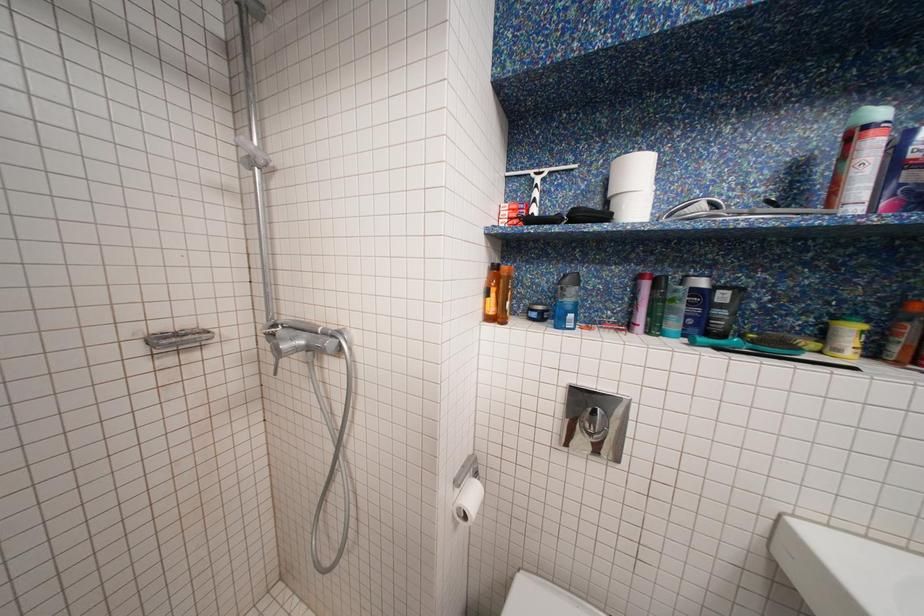
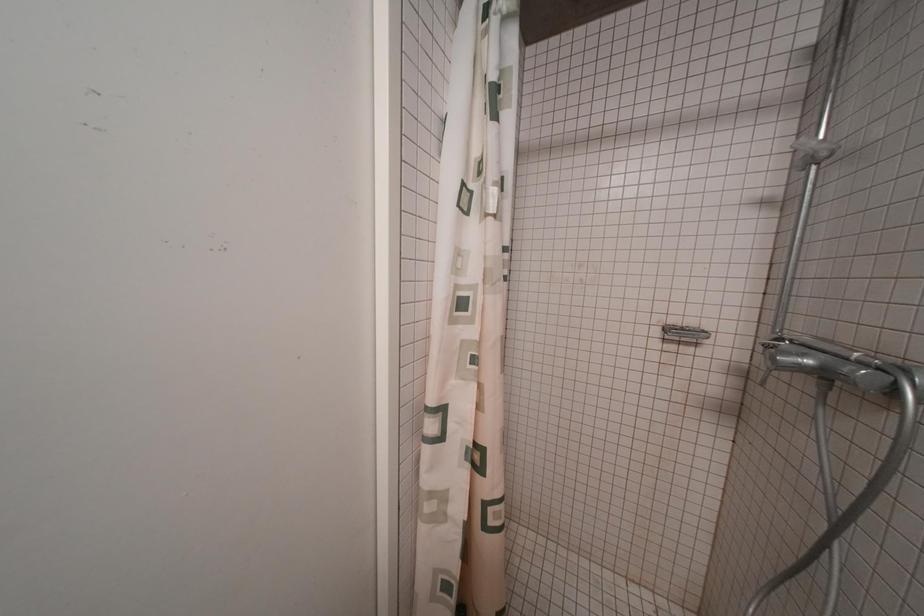
Question: Based on the continuous images, in which direction is the camera rotating? Reply with the corresponding letter.

Choices:
 (A) Left
 (B) Right
 (C) Up
 (D) Down

Answer: (A)